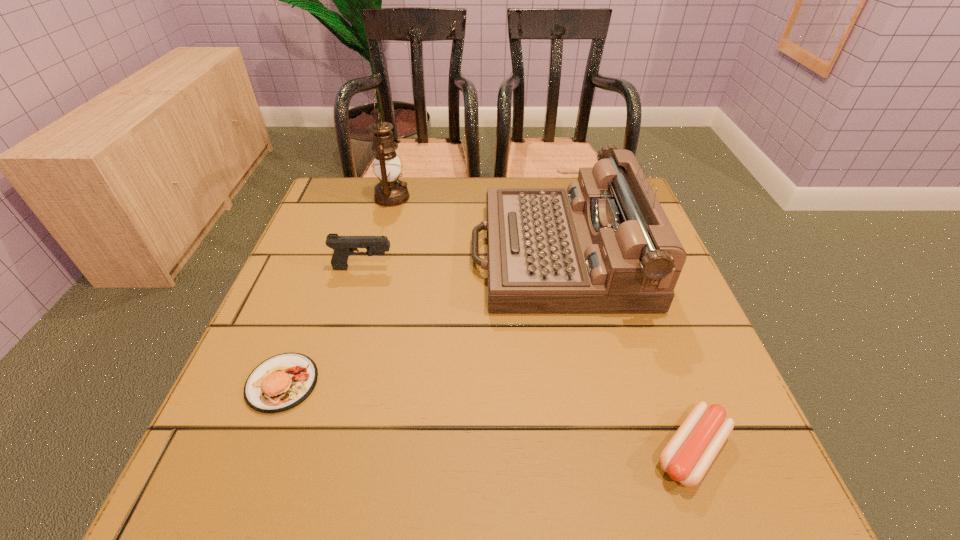
At what (x,y) coordinates should I click in order to perform the action: click on free space located on the back of the patty. Please return your answer as a coordinate pair (x, y). The width and height of the screenshot is (960, 540). Looking at the image, I should click on (337, 240).

Image resolution: width=960 pixels, height=540 pixels. Find the location of `vacant space located 0.210m on the back of the shortest object`. vacant space located 0.210m on the back of the shortest object is located at coordinates (642, 315).

Identify the location of oil lamp located in the far edge section of the desktop. (390, 192).

This screenshot has width=960, height=540. I want to click on typewriter located at the far edge, so click(604, 245).

The image size is (960, 540). What are the coordinates of `object that is positioned at the near edge` in the screenshot? It's located at (688, 455).

The width and height of the screenshot is (960, 540). In order to click on oil lamp at the left edge in this screenshot , I will do `click(390, 192)`.

Locate an element on the screen. pistol that is positioned at the left edge is located at coordinates (344, 246).

You are a GUI agent. You are given a task and a screenshot of the screen. Output one action in this format:
    pyautogui.click(x=<x>, y=<y>)
    Task: Click on the patty that is at the left edge
    This screenshot has height=540, width=960.
    Given the screenshot: What is the action you would take?
    tap(281, 382)

This screenshot has width=960, height=540. What are the coordinates of `typewriter at the right edge` in the screenshot? It's located at (604, 245).

Find the location of a particular element. sausage present at the right edge is located at coordinates (688, 455).